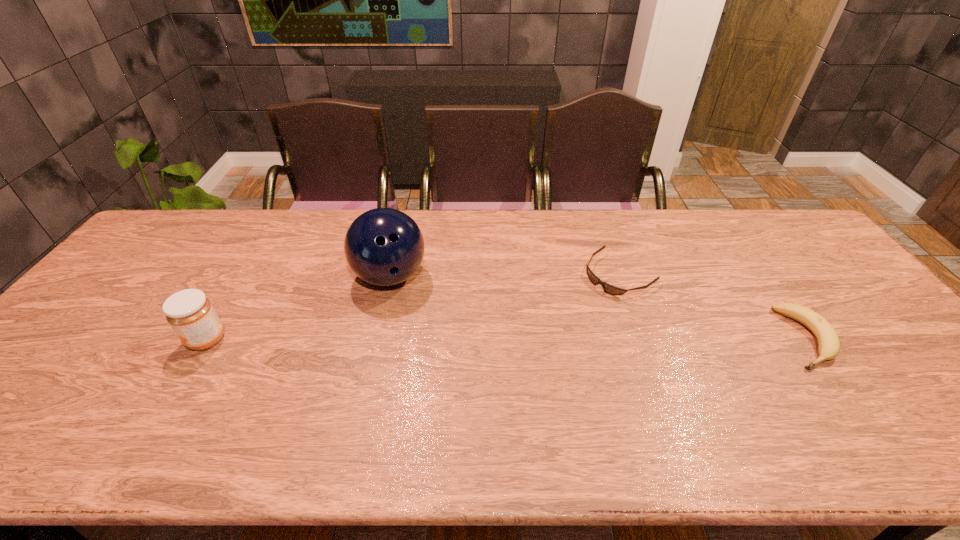
The image size is (960, 540). I want to click on vacant space on the desktop that is between the jam and the second shortest object and is positioned on the front-facing side of the shortest object, so click(528, 339).

You are a GUI agent. You are given a task and a screenshot of the screen. Output one action in this format:
    pyautogui.click(x=<x>, y=<y>)
    Task: Click on the vacant space on the desktop that is between the leftmost object and the banana and is positioned on the surface of the second object from left to right near the finger holes
    The width and height of the screenshot is (960, 540).
    Given the screenshot: What is the action you would take?
    pyautogui.click(x=454, y=339)